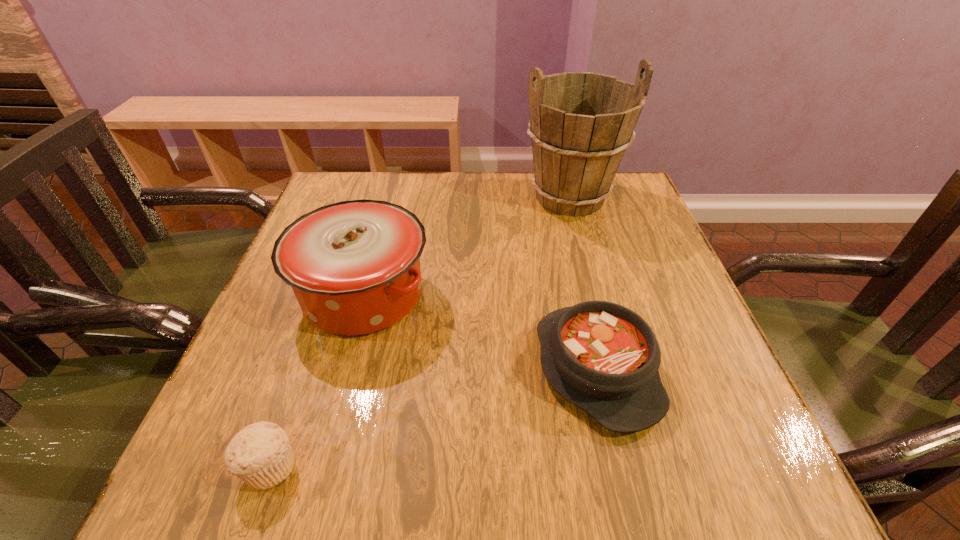
You are a GUI agent. You are given a task and a screenshot of the screen. Output one action in this format:
    pyautogui.click(x=<x>, y=<y>)
    Task: Click on the object present at the far edge
    This screenshot has height=540, width=960.
    Given the screenshot: What is the action you would take?
    pyautogui.click(x=581, y=123)

Where is `casserole that is positioned at the near edge`? This screenshot has height=540, width=960. casserole that is positioned at the near edge is located at coordinates (604, 358).

Locate an element on the screen. The height and width of the screenshot is (540, 960). muffin at the near edge is located at coordinates (260, 454).

Identify the location of casserole that is at the left edge. (354, 266).

Identify the location of muffin at the left edge. The image size is (960, 540). (260, 454).

This screenshot has width=960, height=540. Find the location of `bucket present at the right edge`. bucket present at the right edge is located at coordinates (581, 123).

Identify the location of casserole that is at the right edge. (604, 358).

Identify the location of object located at the near left corner. (260, 454).

Where is `object positioned at the far right corner`? The height and width of the screenshot is (540, 960). object positioned at the far right corner is located at coordinates (581, 123).

Where is `object that is positioned at the near right corner`? Image resolution: width=960 pixels, height=540 pixels. object that is positioned at the near right corner is located at coordinates (604, 358).